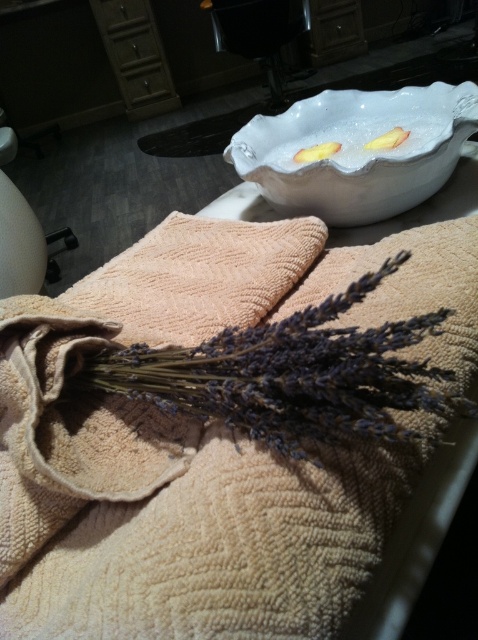
Who is shorter, beige textured towel at center or white glossy bowl at upper center?

white glossy bowl at upper center is shorter.

Image resolution: width=478 pixels, height=640 pixels. In order to click on beige textured towel at center in this screenshot , I will do `click(202, 442)`.

Is the position of dry purple lavender at center less distant than that of white glossy bowl at upper center?

That is True.

Does point (175, 387) come closer to viewer compared to point (471, 102)?

Yes.

Is point (227, 337) farther from camera compared to point (366, 132)?

No.

The width and height of the screenshot is (478, 640). I want to click on dry purple lavender at center, so click(x=293, y=376).

Can you confirm if beige textured towel at center is positioned to the right of dry purple lavender at center?

No, beige textured towel at center is not to the right of dry purple lavender at center.

Does beige textured towel at center have a lesser height compared to dry purple lavender at center?

No, beige textured towel at center is not shorter than dry purple lavender at center.

What do you see at coordinates (202, 442) in the screenshot? I see `beige textured towel at center` at bounding box center [202, 442].

At what (x,y) coordinates should I click in order to perform the action: click on beige textured towel at center. Please return your answer as a coordinate pair (x, y). The width and height of the screenshot is (478, 640). Looking at the image, I should click on (202, 442).